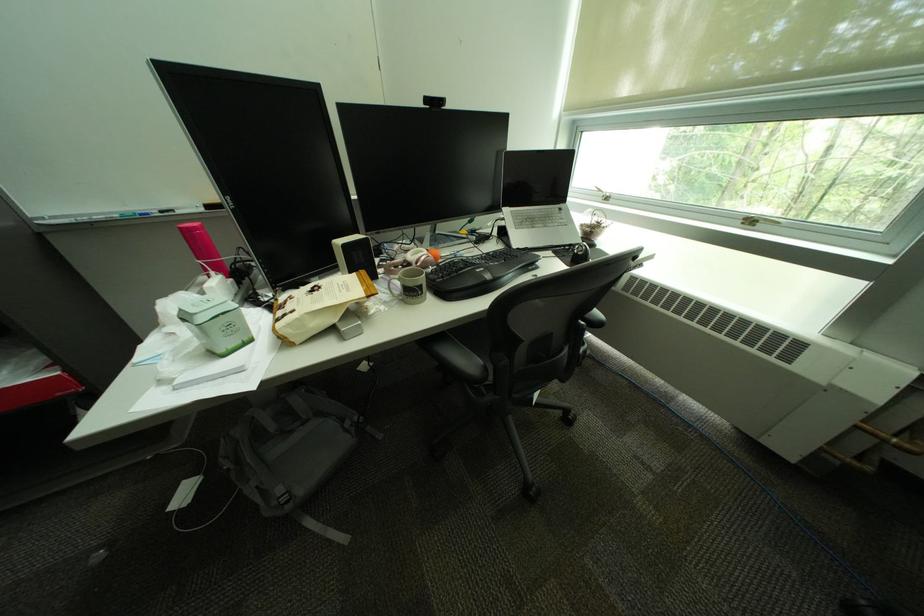
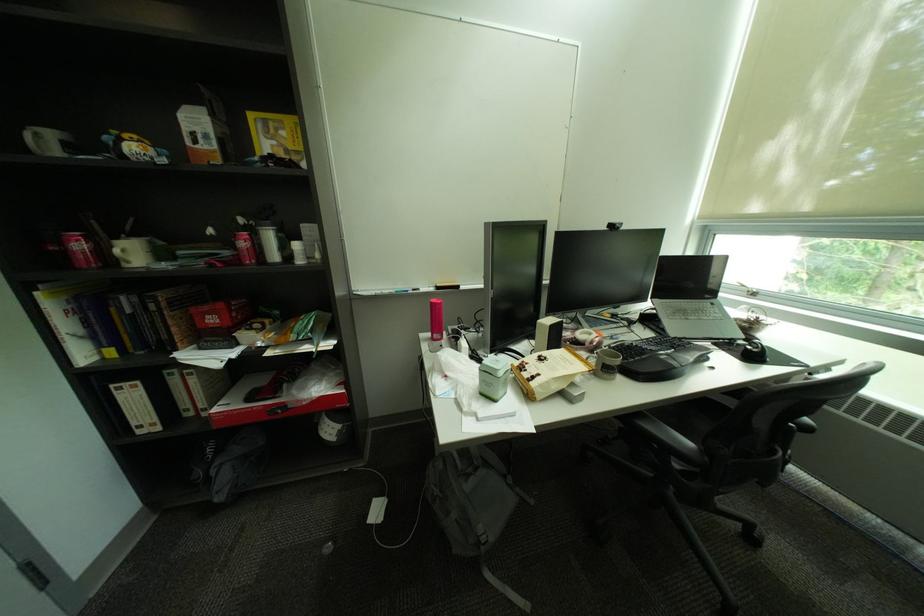
Locate, in the second image, the point that corresponds to [416,296] in the first image.

(613, 371)